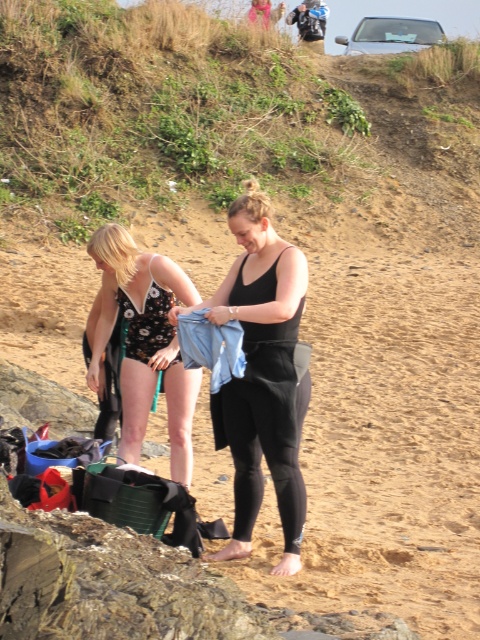
You are a lifeguard who needs to retrieve the black matte tank top at center and the black floral swimsuit at left for lost and found. If your reach is 28 inches, can you grab both items without moving?

The distance between the black matte tank top at center and the black floral swimsuit at left is 28.52 inches, which is slightly beyond your 28 inches reach. Therefore, you cannot grab both items without moving.

You are a fashion designer observing the beach scene. You need to determine which clothing item is more suitable for a petite model. Based on the black matte tank top at center and the black floral swimsuit at left, which one would you choose?

The black matte tank top at center has a smaller size compared to the black floral swimsuit at left, so it would be more suitable for a petite model.

You are a fashion designer observing the beach scene. You need to decide which item of clothing has a narrower width for a size comparison project. Which one is narrower between the black matte tank top at center and the black floral swimsuit at left?

The black matte tank top at center has a lesser width compared to the black floral swimsuit at left, so it is narrower.